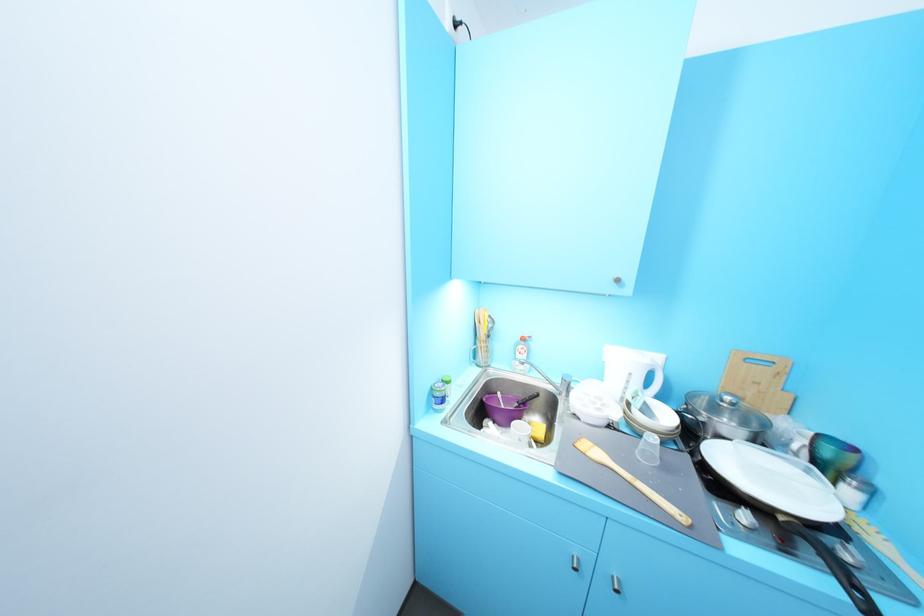
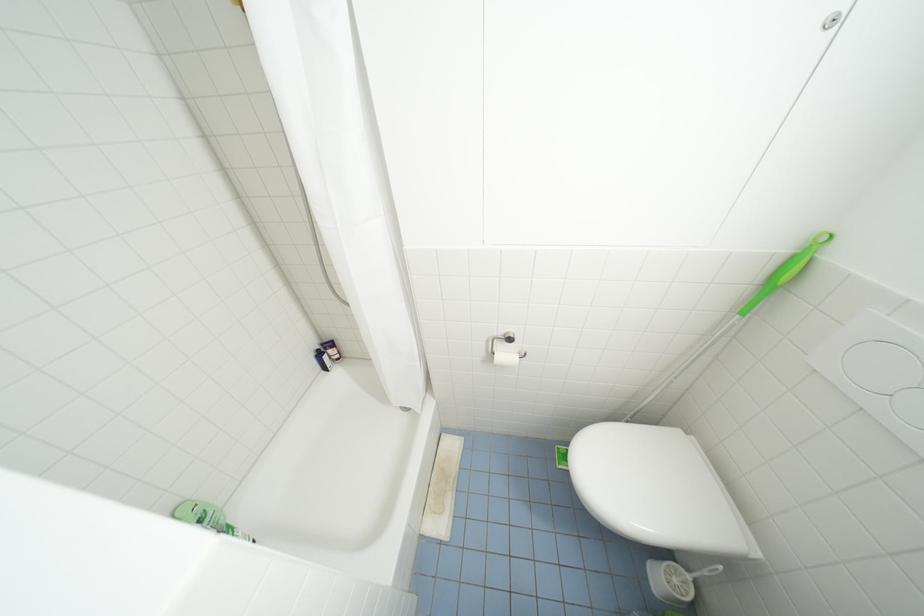
In the scene shown: In a continuous first-person perspective shot, in which direction is the camera moving?

The movement direction of the cameraman is left, forward.